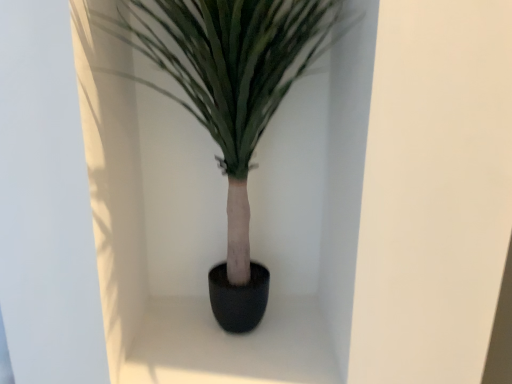
This screenshot has width=512, height=384. Identify the location of vacant area on top of black matte pot at center (from a real-world perspective). (232, 337).